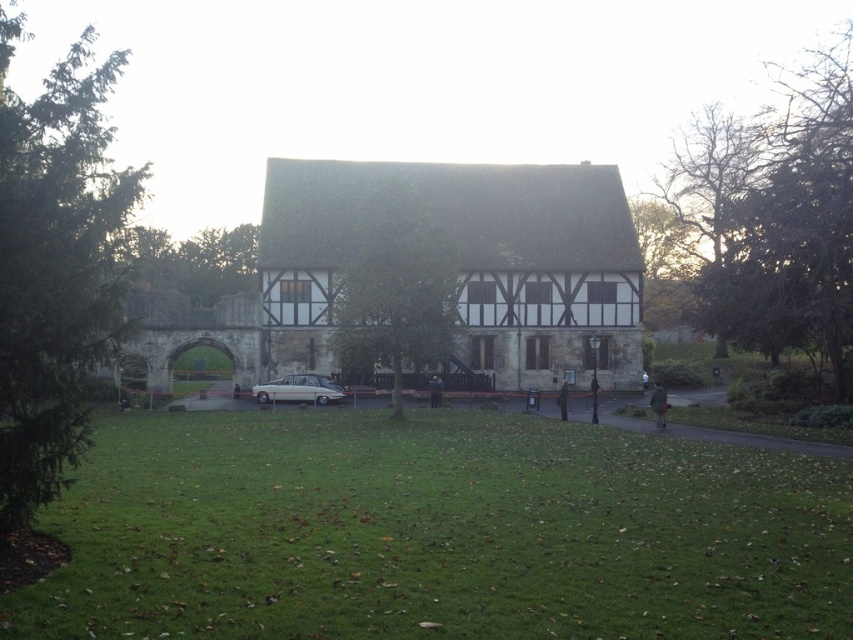
Which is more to the right, green fabric jacket at center or dark blue jacket at center?

From the viewer's perspective, green fabric jacket at center appears more on the right side.

Can you confirm if green fabric jacket at center is wider than dark blue jacket at center?

Yes.

You are a GUI agent. You are given a task and a screenshot of the screen. Output one action in this format:
    pyautogui.click(x=<x>, y=<y>)
    Task: Click on the green fabric jacket at center
    Image resolution: width=853 pixels, height=640 pixels.
    Given the screenshot: What is the action you would take?
    pyautogui.click(x=659, y=404)

Does silver metallic car at center have a larger size compared to dark blue jacket at center?

No, silver metallic car at center is not bigger than dark blue jacket at center.

Between silver metallic car at center and dark blue jacket at center, which one has less height?

silver metallic car at center

Between point (289, 394) and point (431, 403), which one is positioned behind?

The point (289, 394) is behind.

Image resolution: width=853 pixels, height=640 pixels. I want to click on silver metallic car at center, so click(x=299, y=388).

Who is positioned more to the left, green grass at center or dark blue jacket at center?

A: dark blue jacket at center is more to the left.

Can you confirm if green grass at center is smaller than dark blue jacket at center?

Actually, green grass at center might be larger than dark blue jacket at center.

The width and height of the screenshot is (853, 640). I want to click on green grass at center, so click(437, 532).

What are the coordinates of `green grass at center` in the screenshot? It's located at (437, 532).